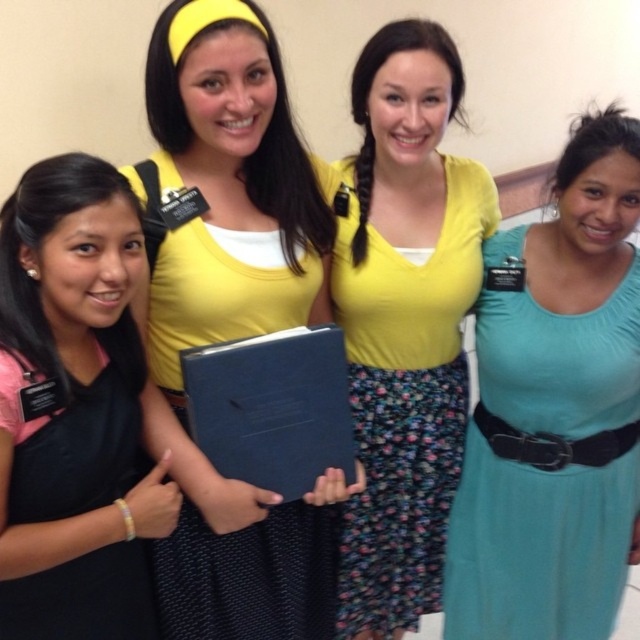
Question: Can you confirm if matte yellow shirt at center is smaller than teal satin dress at right?

Choices:
 (A) yes
 (B) no

Answer: (B)

Question: Which of the following is the closest to the observer?

Choices:
 (A) black matte dress at left
 (B) floral print fabric dress at center
 (C) teal satin dress at right
 (D) matte black book at center

Answer: (A)

Question: Can you confirm if matte black book at center is smaller than teal satin dress at right?

Choices:
 (A) no
 (B) yes

Answer: (B)

Question: Which point is farther to the camera?

Choices:
 (A) floral print fabric dress at center
 (B) blue matte folder at center
 (C) matte yellow shirt at center
 (D) teal satin dress at right

Answer: (A)

Question: Is matte black book at center below black matte dress at left?

Choices:
 (A) no
 (B) yes

Answer: (A)

Question: Which is nearer to the matte yellow shirt at center?

Choices:
 (A) matte black book at center
 (B) floral print fabric dress at center

Answer: (A)